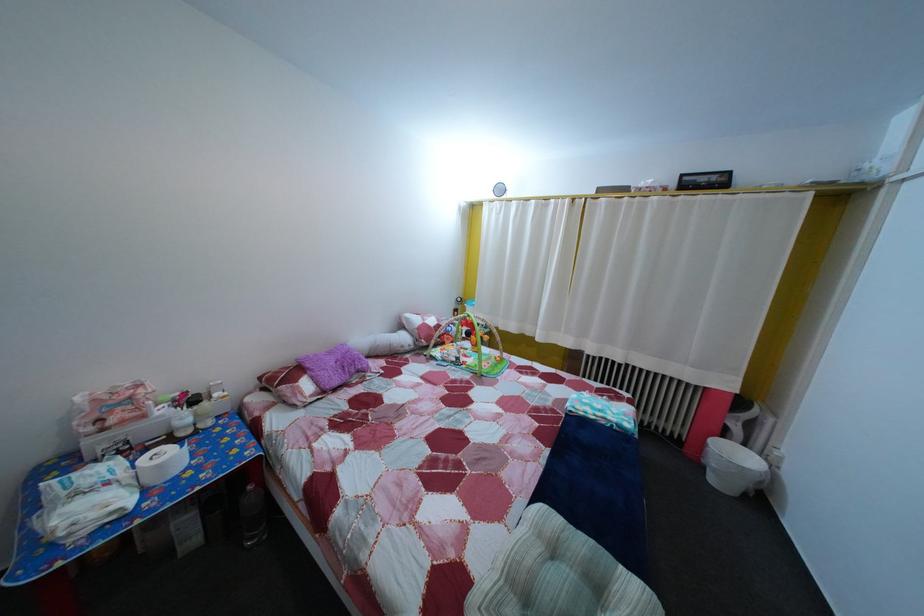
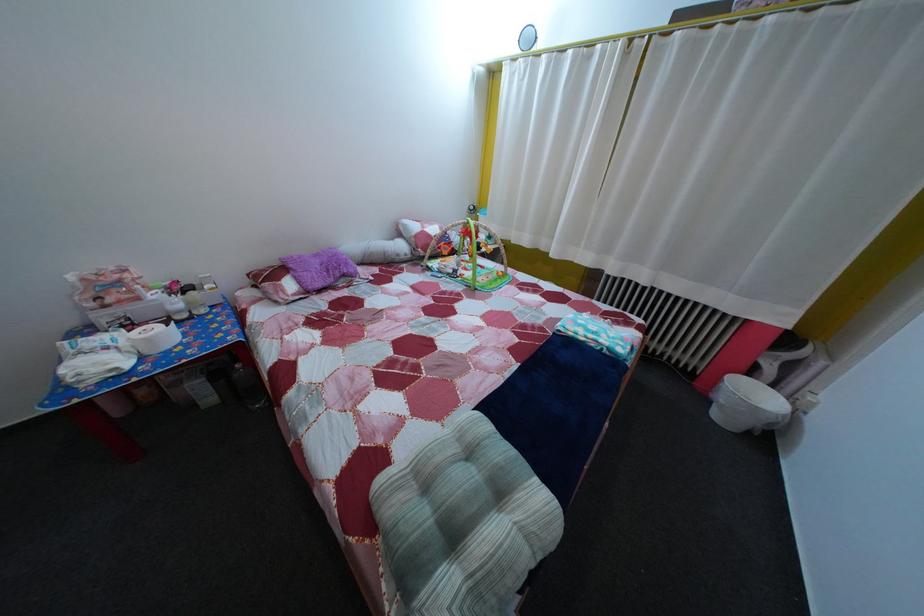
In a continuous first-person perspective shot, in which direction is the camera moving?

The movement direction of the cameraman is right, forward.